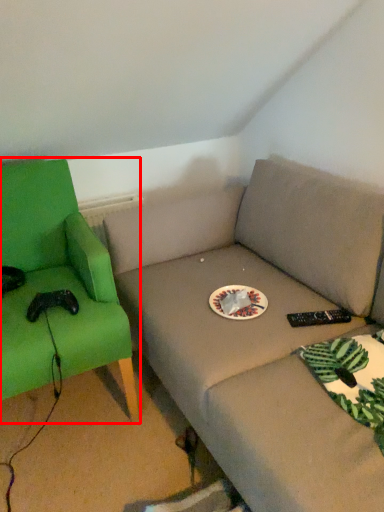
Question: In this image, where is chair (annotated by the red box) located relative to paper plate?

Choices:
 (A) right
 (B) left

Answer: (B)